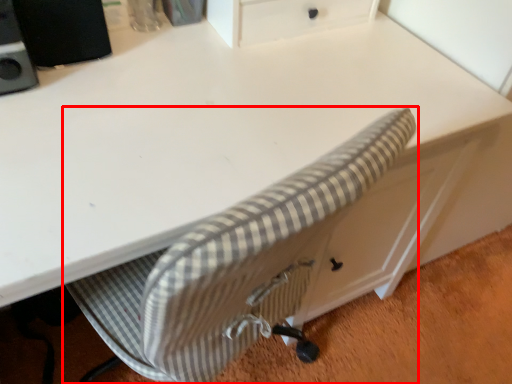
Question: From the image's perspective, where is chair (annotated by the red box) located relative to speaker?

Choices:
 (A) above
 (B) below

Answer: (B)